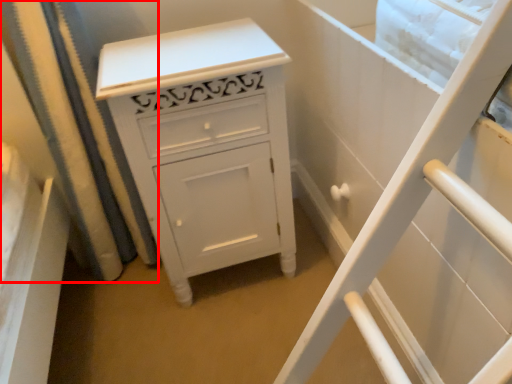
Question: In this image, where is shower curtain (annotated by the red box) located relative to chest of drawers?

Choices:
 (A) left
 (B) right

Answer: (A)